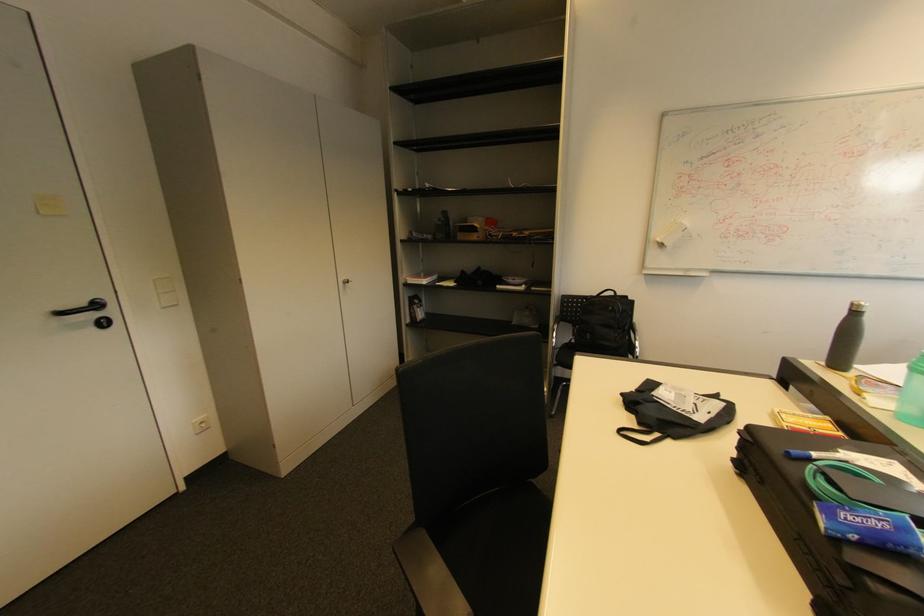
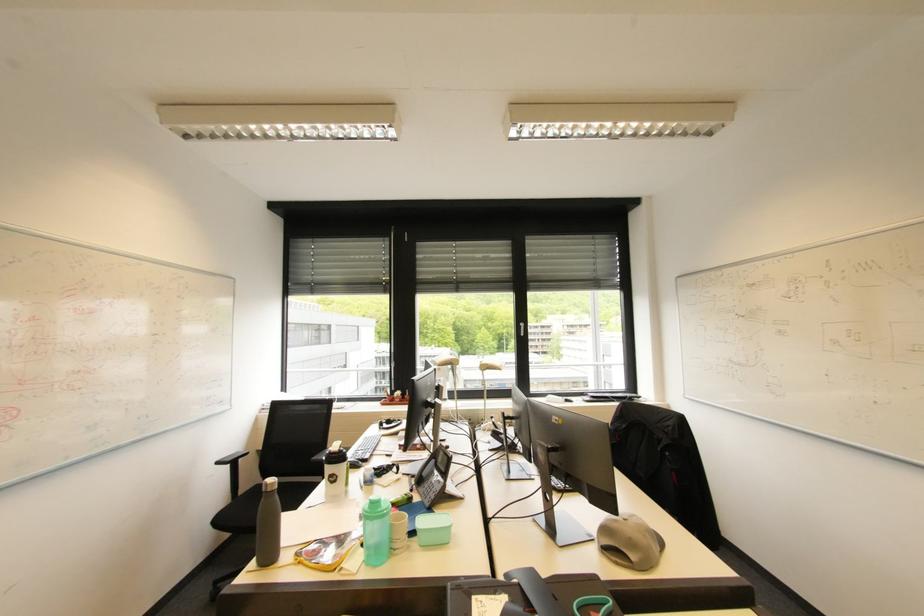
Question: The images are taken continuously from a first-person perspective. In which direction is your viewpoint rotating?

Choices:
 (A) Left
 (B) Right
 (C) Up
 (D) Down

Answer: (B)